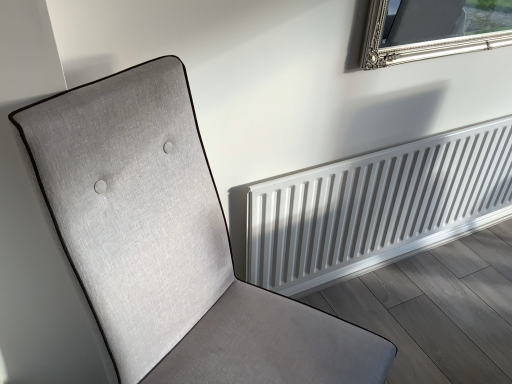
Question: From the image's perspective, is white metallic radiator at lower right on top of textured fabric chair at left?

Choices:
 (A) yes
 (B) no

Answer: (A)

Question: Does white metallic radiator at lower right appear on the left side of textured fabric chair at left?

Choices:
 (A) no
 (B) yes

Answer: (A)

Question: Can you confirm if white metallic radiator at lower right is wider than textured fabric chair at left?

Choices:
 (A) yes
 (B) no

Answer: (B)

Question: Can you confirm if white metallic radiator at lower right is shorter than textured fabric chair at left?

Choices:
 (A) no
 (B) yes

Answer: (B)

Question: Is white metallic radiator at lower right to the right of textured fabric chair at left from the viewer's perspective?

Choices:
 (A) yes
 (B) no

Answer: (A)

Question: Is textured fabric chair at left surrounded by white metallic radiator at lower right?

Choices:
 (A) no
 (B) yes

Answer: (A)

Question: Does textured fabric chair at left appear on the right side of white metallic radiator at lower right?

Choices:
 (A) no
 (B) yes

Answer: (A)

Question: Could you tell me if textured fabric chair at left is turned towards white metallic radiator at lower right?

Choices:
 (A) no
 (B) yes

Answer: (A)

Question: Does textured fabric chair at left appear on the left side of white metallic radiator at lower right?

Choices:
 (A) yes
 (B) no

Answer: (A)

Question: From a real-world perspective, does textured fabric chair at left sit lower than white metallic radiator at lower right?

Choices:
 (A) yes
 (B) no

Answer: (B)

Question: Does textured fabric chair at left have a greater width compared to white metallic radiator at lower right?

Choices:
 (A) yes
 (B) no

Answer: (A)

Question: Is textured fabric chair at left closer to the viewer compared to white metallic radiator at lower right?

Choices:
 (A) no
 (B) yes

Answer: (B)

Question: Is textured fabric chair at left bigger or smaller than white metallic radiator at lower right?

Choices:
 (A) small
 (B) big

Answer: (B)